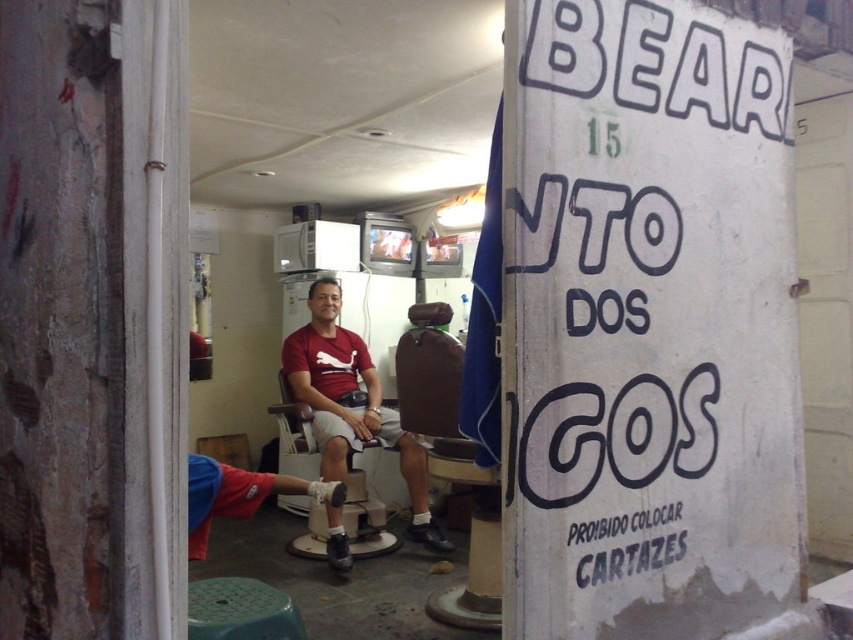
Question: Where is white paper sign at upper right located in relation to matte red shirt at center in the image?

Choices:
 (A) right
 (B) left

Answer: (A)

Question: Is matte plastic chair at center below brown leather chair at center?

Choices:
 (A) no
 (B) yes

Answer: (B)

Question: Which point appears closest to the camera in this image?

Choices:
 (A) (291, 426)
 (B) (238, 630)
 (C) (657, 134)

Answer: (B)

Question: Estimate the real-world distances between objects in this image. Which object is closer to the matte plastic chair at center?

Choices:
 (A) blue fabric leg at lower center
 (B) matte red shirt at center
 (C) brown matte hair at center
 (D) green plastic stool at lower left

Answer: (B)

Question: Which object appears farthest from the camera in this image?

Choices:
 (A) brown matte hair at center
 (B) brown leather chair at center
 (C) white paper sign at upper right
 (D) matte plastic chair at center

Answer: (A)

Question: Is white paper sign at upper right below brown matte hair at center?

Choices:
 (A) yes
 (B) no

Answer: (A)